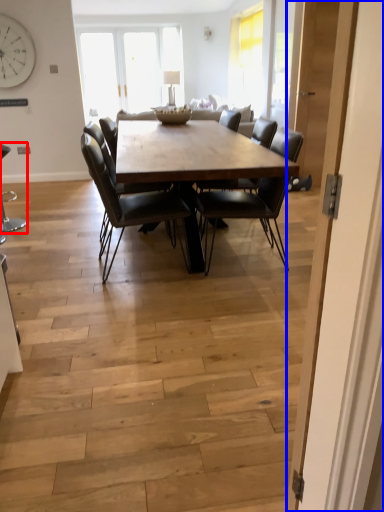
Question: Which of the following is the farthest to the observer, chair (highlighted by a red box) or door (highlighted by a blue box)?

Choices:
 (A) chair
 (B) door

Answer: (A)